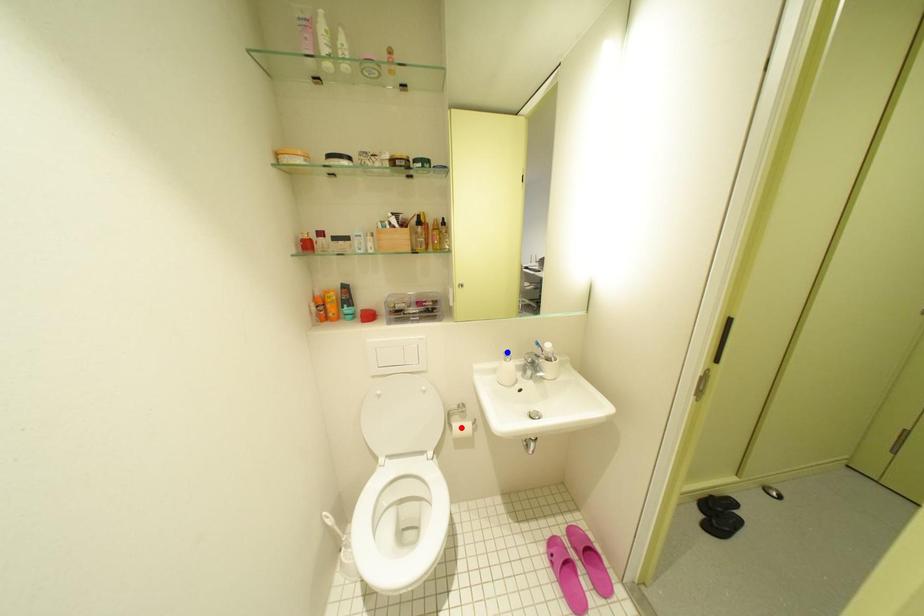
Question: In the image, two points are highlighted. Which point is nearer to the camera? Reply with the corresponding letter.

Choices:
 (A) blue point
 (B) red point

Answer: (A)